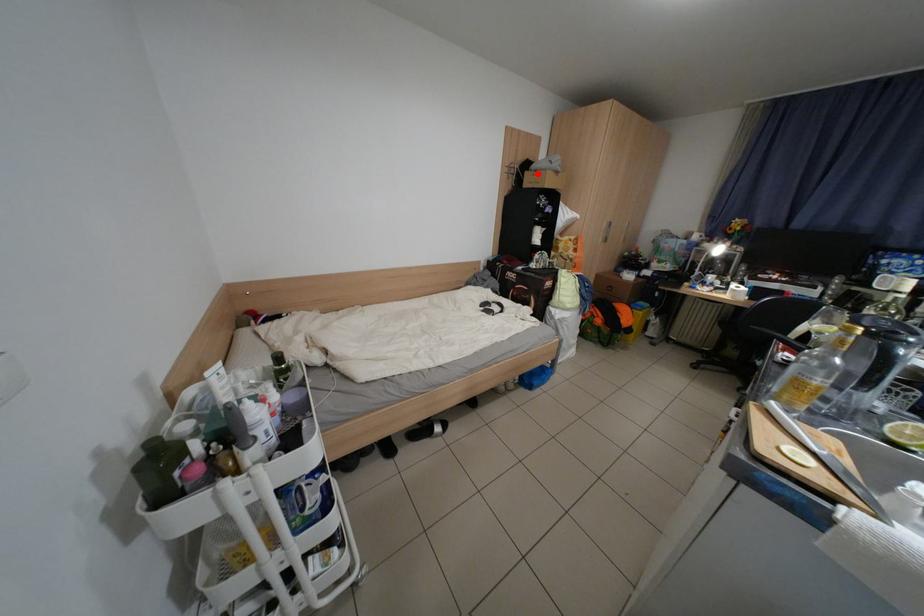
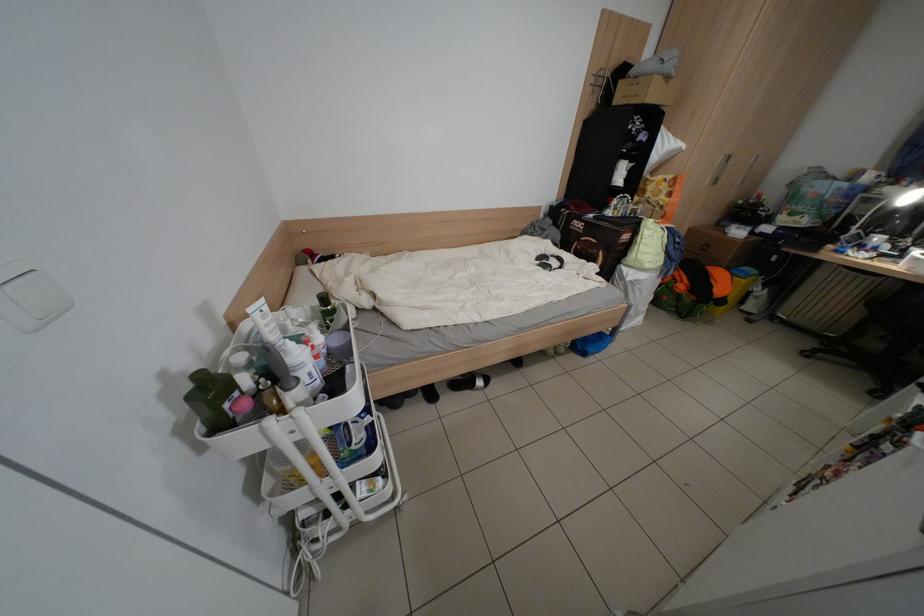
Question: I am providing you with two images of the same scene from different viewpoints. Image1 has a red point marked. In image2, the corresponding 3D location appears at what relative position? Reply with the corresponding letter.

Choices:
 (A) Closer
 (B) Farther

Answer: (B)